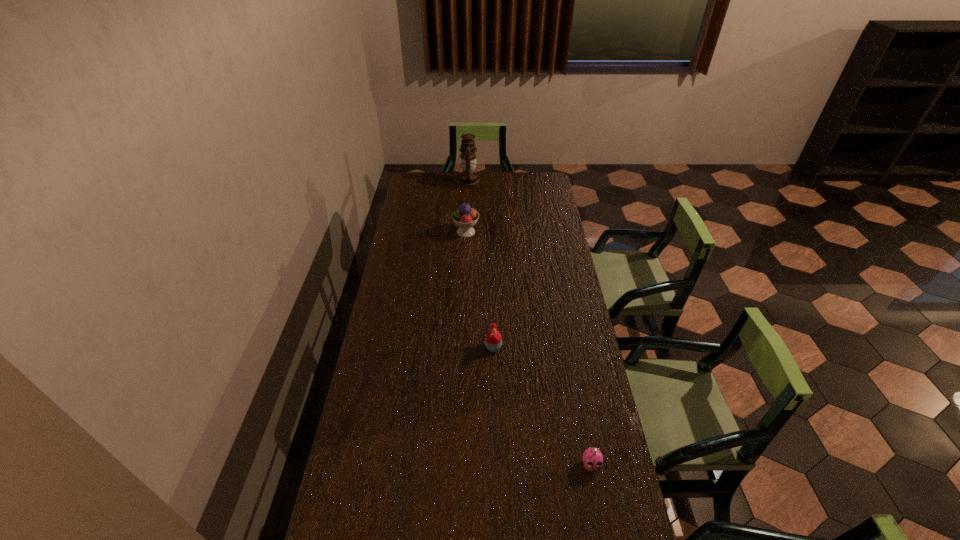
What are the coordinates of `vacant space situated on the face of the third farthest object` in the screenshot? It's located at (385, 347).

You are a GUI agent. You are given a task and a screenshot of the screen. Output one action in this format:
    pyautogui.click(x=<x>, y=<y>)
    Task: Click on the vacant space located on the face of the third farthest object
    This screenshot has width=960, height=540.
    Given the screenshot: What is the action you would take?
    point(449,347)

Find the location of a particular element. The height and width of the screenshot is (540, 960). vacant area situated on the face of the third farthest object is located at coordinates (431, 347).

Where is `blank space located 0.130m on the face of the nearer cupcake`? The image size is (960, 540). blank space located 0.130m on the face of the nearer cupcake is located at coordinates (602, 523).

Where is `object that is at the far edge`? The width and height of the screenshot is (960, 540). object that is at the far edge is located at coordinates (468, 178).

Where is `object that is at the right edge`? object that is at the right edge is located at coordinates (592, 458).

In the image, there is a desktop. What are the coordinates of `free space at the far edge` in the screenshot? It's located at (445, 192).

In the image, there is a desktop. Where is `free space at the left edge`? free space at the left edge is located at coordinates (392, 305).

Find the location of a particular element. The height and width of the screenshot is (540, 960). free space at the right edge of the desktop is located at coordinates (580, 360).

In the image, there is a desktop. Where is `free space at the far left corner`? free space at the far left corner is located at coordinates (428, 179).